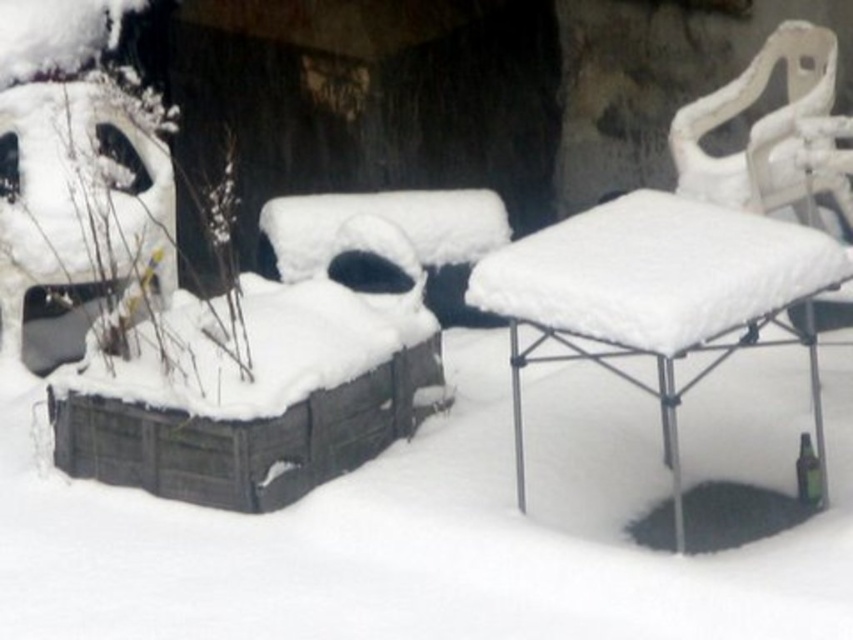
Question: Which of the following is the closest to the observer?

Choices:
 (A) (740, 172)
 (B) (683, 352)

Answer: (B)

Question: Is white fluffy table at center to the left of white plastic chair at upper right from the viewer's perspective?

Choices:
 (A) yes
 (B) no

Answer: (A)

Question: Does white fluffy table at center have a lesser width compared to white matte panda at left?

Choices:
 (A) no
 (B) yes

Answer: (A)

Question: Estimate the real-world distances between objects in this image. Which object is farther from the white fluffy table at center?

Choices:
 (A) white matte panda at left
 (B) white plastic chair at upper right

Answer: (A)

Question: Among these points, which one is nearest to the camera?

Choices:
 (A) (753, 138)
 (B) (488, 298)
 (C) (151, 147)

Answer: (B)

Question: Does white fluffy table at center appear over white matte panda at left?

Choices:
 (A) no
 (B) yes

Answer: (A)